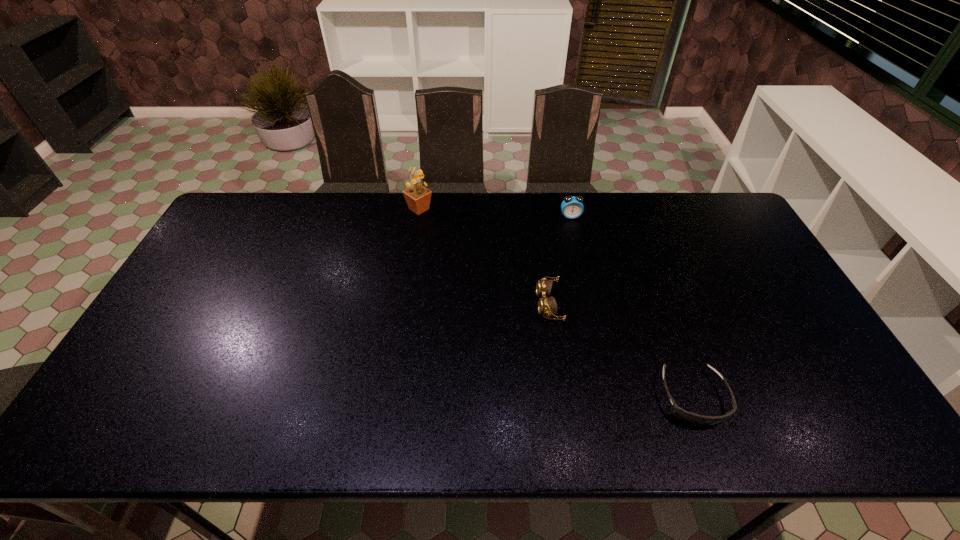
You are a GUI agent. You are given a task and a screenshot of the screen. Output one action in this format:
    pyautogui.click(x=<x>, y=<y>)
    Task: Click on the third closest object relative to the third object from left to right
    The height and width of the screenshot is (540, 960).
    Given the screenshot: What is the action you would take?
    pyautogui.click(x=695, y=419)

Where is `free region that satisfies the following two spatial constraints: 1. on the face of the alarm clock; 2. through the lenses of the third farthest object`? The height and width of the screenshot is (540, 960). free region that satisfies the following two spatial constraints: 1. on the face of the alarm clock; 2. through the lenses of the third farthest object is located at coordinates (590, 305).